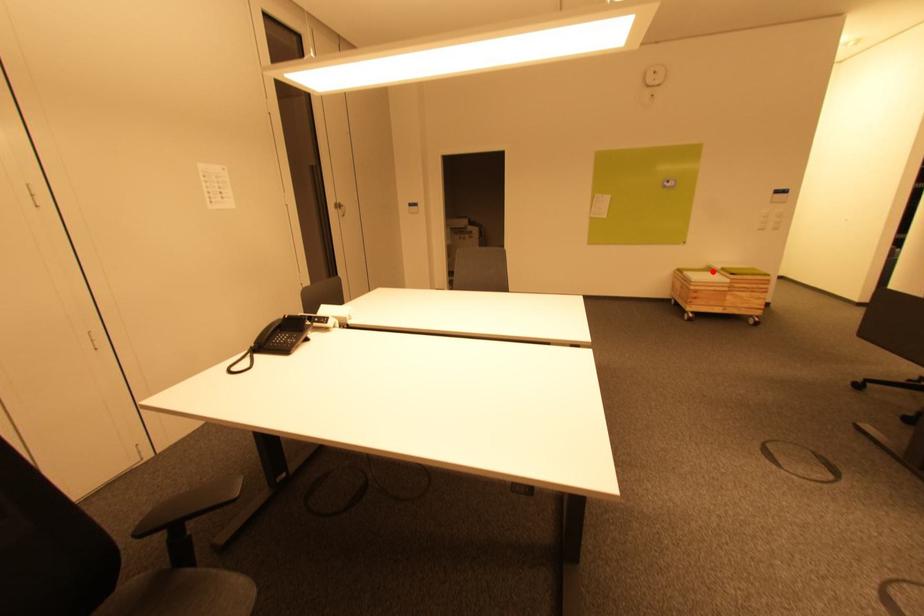
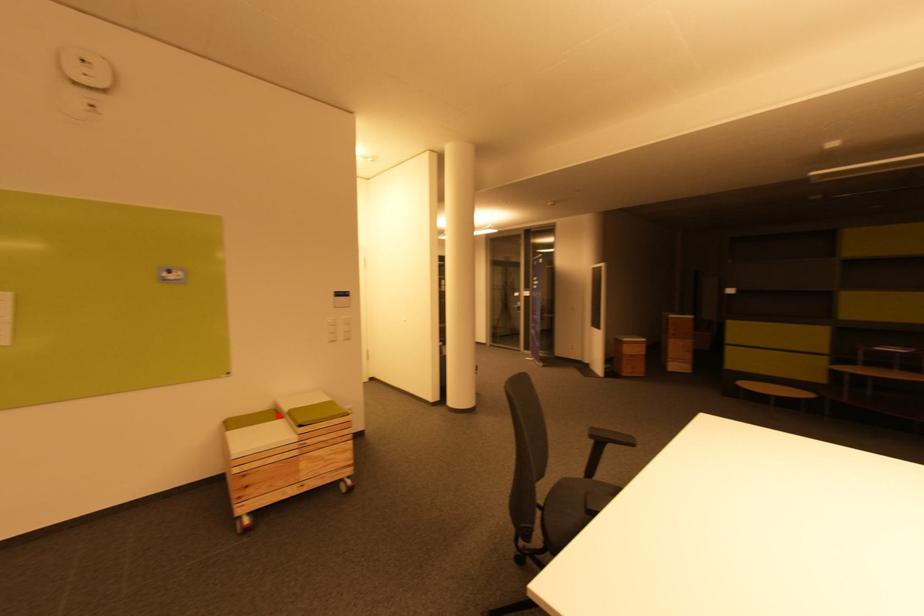
I am providing you with two images of the same scene from different viewpoints. A red point is marked on the first image and another point is marked on the second image. Does the point marked in image1 correspond to the same location as the one in image2?

Yes